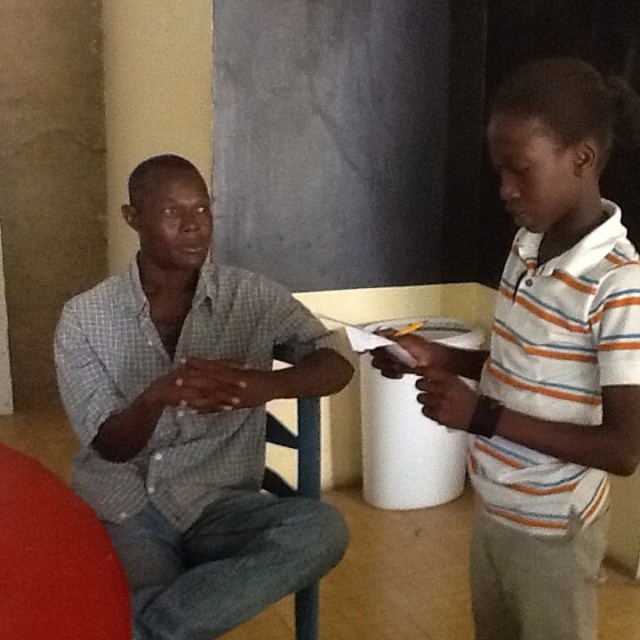
You are standing in the room and want to touch the checkered fabric shirt at left. Which direction should you move relative to the red circular object located at point (x=193, y=417)?

The point (x=193, y=417) corresponds to the checkered fabric shirt at left, so you should move towards that point to touch it.

You are an interior designer assessing the placement of items in the scene. The checkered fabric shirt at left is part of the decor. Is it positioned closer to the top or bottom of the image?

The checkered fabric shirt at left is located at point (193, 417), so it is positioned closer to the bottom of the image.

You are organizing a clothing donation drive and need to determine if the checkered fabric shirt at left and the white striped shirt at right can fit into a box that has a maximum capacity of 1000 cubic centimeters. Given their sizes, can both shirts fit together in the box?

The checkered fabric shirt at left is bigger than the white striped shirt at right. However, without specific size measurements, it is impossible to determine if both can fit into the box with a 1000 cubic centimeter capacity.